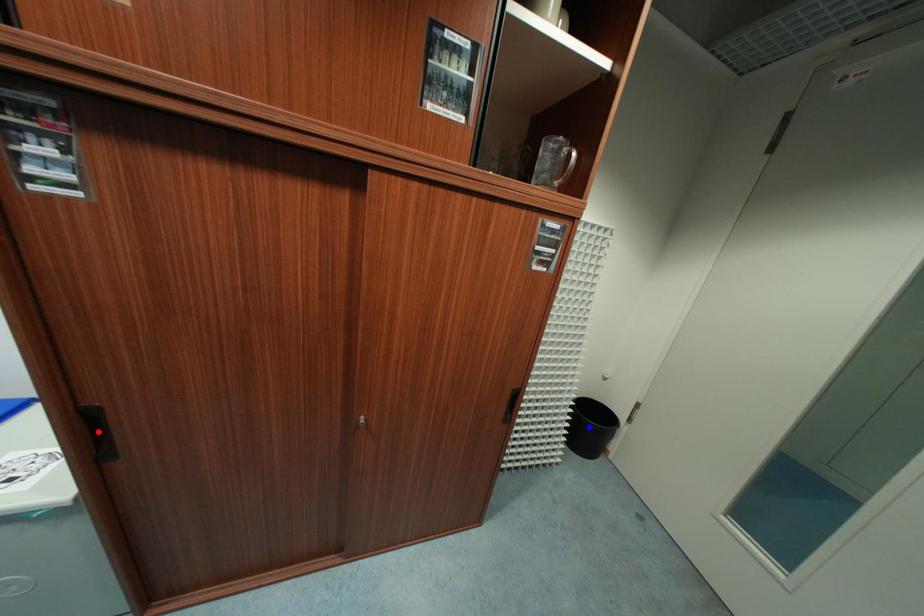
Question: Two points are marked on the image. Which point is closer to the camera?

Choices:
 (A) Blue point is closer.
 (B) Red point is closer.

Answer: (B)